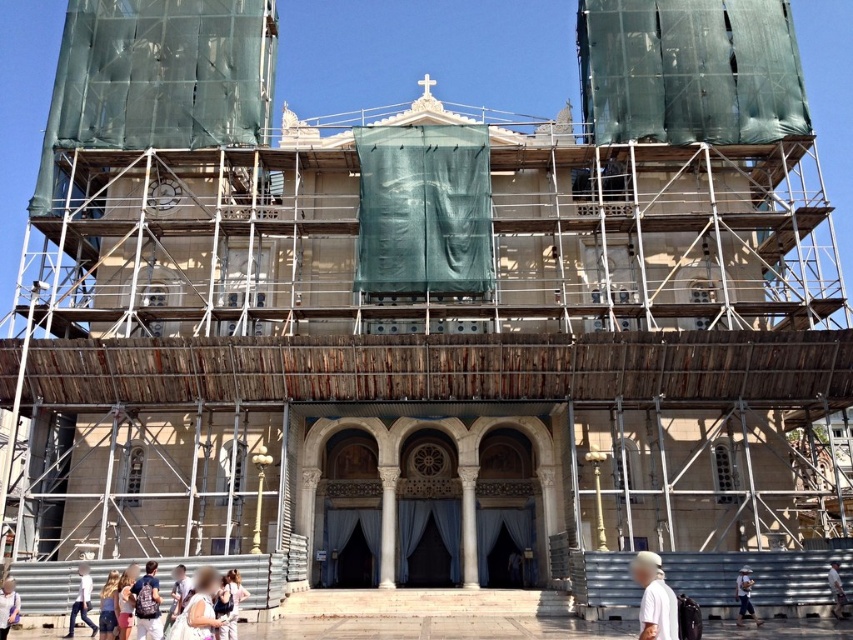
You are a photographer standing in front of the ornate building under renovation. You notice a white matte shirt at lower right and a white cotton dress at center. Which clothing item is positioned higher in the image?

The white matte shirt at lower right is above the white cotton dress at center, so the white matte shirt at lower right is positioned higher in the image.